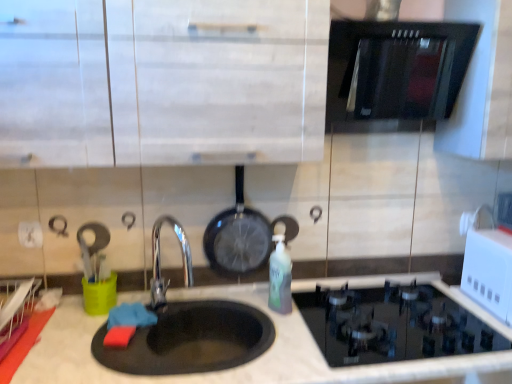
Question: From the image's perspective, is translucent green bottle at center positioned above or below white glossy microwave at upper right?

Choices:
 (A) above
 (B) below

Answer: (B)

Question: Is translucent green bottle at center taller or shorter than white glossy microwave at upper right?

Choices:
 (A) short
 (B) tall

Answer: (B)

Question: Estimate the real-world distances between objects in this image. Which object is farther from the white matte cabinet at upper center?

Choices:
 (A) black matte pizza pan at lower center
 (B) black matte wok at center
 (C) black glass oven at upper right
 (D) translucent green bottle at center
 (E) white glossy microwave at upper right

Answer: (E)

Question: Which object is positioned closest to the black glass gas stove at lower right?

Choices:
 (A) black matte wok at center
 (B) translucent green bottle at center
 (C) white marble countertop at center
 (D) black matte pizza pan at lower center
 (E) black glass oven at upper right

Answer: (C)